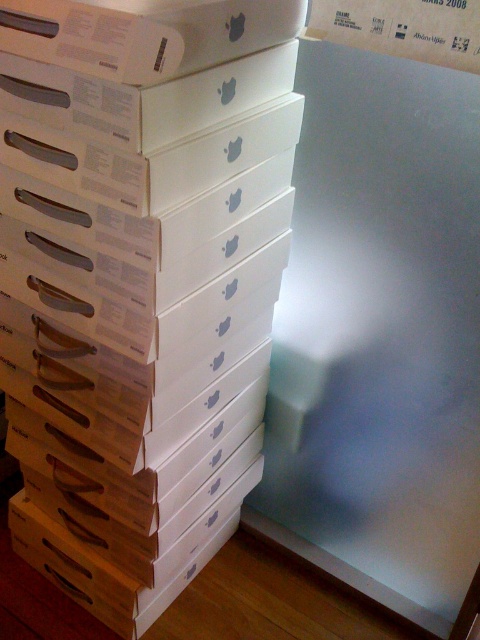
Which is in front, point (111, 324) or point (369, 28)?

Point (369, 28) is in front.

Can you confirm if white cardboard boxes at center is bigger than white cardboard box at upper center?

Yes.

Find the location of a particular element. white cardboard boxes at center is located at coordinates (140, 289).

This screenshot has width=480, height=640. In order to click on white cardboard boxes at center in this screenshot , I will do `click(140, 289)`.